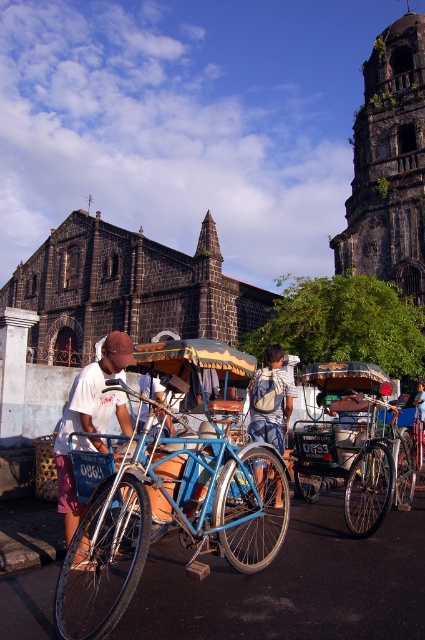
Question: Which of the following is the closest to the observer?

Choices:
 (A) blue denim shorts at center
 (B) matte black helmet at center

Answer: (B)

Question: Does blue matte bicycle at center lie in front of light brown wooden stick at center?

Choices:
 (A) no
 (B) yes

Answer: (B)

Question: Which point is farther to the camera?

Choices:
 (A) brushed metal bicycle at left
 (B) metallic blue rickshaw at center

Answer: (B)

Question: Is blue matte bicycle at center thinner than light brown wooden stick at center?

Choices:
 (A) no
 (B) yes

Answer: (A)

Question: Which is farther from the light brown wooden stick at center?

Choices:
 (A) blue matte bicycle at center
 (B) blue denim shorts at center
 (C) matte black helmet at center
 (D) dark stone tower at upper right

Answer: (D)

Question: Does dark stone tower at upper right appear over matte black helmet at center?

Choices:
 (A) yes
 (B) no

Answer: (A)